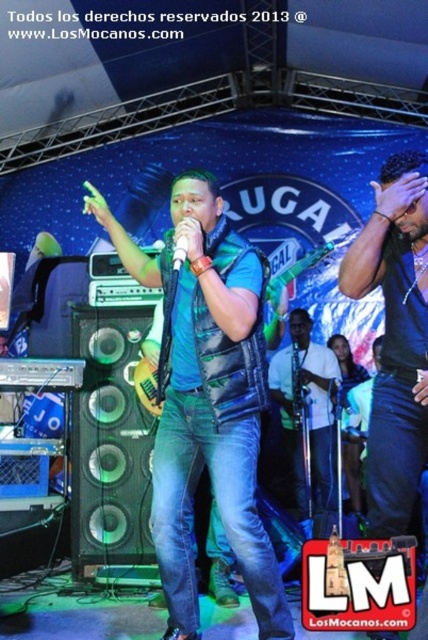
You are a stagehand setting up for the performance. You need to position a new spotlight so that it shines on the blue leather vest at center without illuminating the white plastic microphone at center. Based on their positions, which direction should you aim the spotlight relative to the microphone?

The blue leather vest at center is to the right of the white plastic microphone at center, so the spotlight should be aimed to the right of the microphone to shine on the vest without hitting the microphone.

You are a costume designer reviewing the performer outfit in the image. The blue leather vest at center and white matte shirt at center are part of the outfit. Which clothing item is on the left side?

The blue leather vest at center is positioned on the left side of white matte shirt at center, so the blue leather vest at center is on the left.